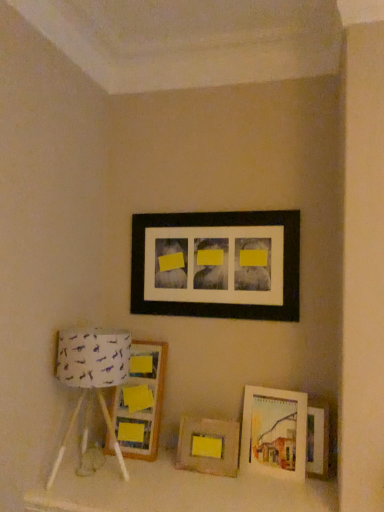
What do you see at coordinates (274, 432) in the screenshot?
I see `matte wooden picture frame at lower right, acting as the third picture frame starting from the bottom` at bounding box center [274, 432].

What are the coordinates of `black matte picture frame at upper center, the first picture frame in the top-to-bottom sequence` in the screenshot? It's located at (217, 265).

The image size is (384, 512). What do you see at coordinates (143, 409) in the screenshot?
I see `wooden picture frame at left, which appears as the 4th picture frame when ordered from the bottom` at bounding box center [143, 409].

Measure the distance between wooden picture frame at left, which appears as the 4th picture frame when ordered from the bottom, and camera.

The depth of wooden picture frame at left, which appears as the 4th picture frame when ordered from the bottom, is 6.29 feet.

Looking at this image, measure the distance between point (x=314, y=461) and camera.

The depth of point (x=314, y=461) is 1.80 meters.

What is the approximate width of wooden picture frame at lower right, the second picture frame positioned from the bottom?

wooden picture frame at lower right, the second picture frame positioned from the bottom, is 4.06 centimeters wide.

Measure the distance between white fabric lampshade at left and camera.

The distance of white fabric lampshade at left from camera is 5.54 feet.

Describe the element at coordinates (91, 378) in the screenshot. Image resolution: width=384 pixels, height=512 pixels. I see `white fabric lampshade at left` at that location.

The width and height of the screenshot is (384, 512). I want to click on matte wooden picture frame at lower right, acting as the third picture frame starting from the bottom, so click(274, 432).

Is wooden picture frame at left, which is the second picture frame in top-to-bottom order, taller or shorter than matte wooden picture frame at lower right, which appears as the 3th picture frame when viewed from the top?

Answer: Clearly, wooden picture frame at left, which is the second picture frame in top-to-bottom order, is taller compared to matte wooden picture frame at lower right, which appears as the 3th picture frame when viewed from the top.

Is wooden picture frame at left, which is the second picture frame in top-to-bottom order, bigger than matte wooden picture frame at lower right, which appears as the 3th picture frame when viewed from the top?

Correct, wooden picture frame at left, which is the second picture frame in top-to-bottom order, is larger in size than matte wooden picture frame at lower right, which appears as the 3th picture frame when viewed from the top.

Can matte wooden picture frame at lower right, which appears as the 3th picture frame when viewed from the top, be found inside wooden picture frame at left, which appears as the 4th picture frame when ordered from the bottom?

No, matte wooden picture frame at lower right, which appears as the 3th picture frame when viewed from the top, is not inside wooden picture frame at left, which appears as the 4th picture frame when ordered from the bottom.

Does point (142, 380) lie in front of point (272, 438)?

No, it is behind (272, 438).

Between wooden frame at center, which appears as the 1th picture frame when ordered from the bottom, and matte wooden picture frame at lower right, which appears as the 3th picture frame when viewed from the top, which one appears on the left side from the viewer's perspective?

Positioned to the left is wooden frame at center, which appears as the 1th picture frame when ordered from the bottom.

Between wooden frame at center, which appears as the 1th picture frame when ordered from the bottom, and matte wooden picture frame at lower right, acting as the third picture frame starting from the bottom, which one has more height?

With more height is matte wooden picture frame at lower right, acting as the third picture frame starting from the bottom.

Does wooden frame at center, which appears as the 1th picture frame when ordered from the bottom, turn towards matte wooden picture frame at lower right, which appears as the 3th picture frame when viewed from the top?

No, wooden frame at center, which appears as the 1th picture frame when ordered from the bottom, is not aimed at matte wooden picture frame at lower right, which appears as the 3th picture frame when viewed from the top.

How far apart are black matte picture frame at upper center, the first picture frame in the top-to-bottom sequence, and wooden picture frame at left, which appears as the 4th picture frame when ordered from the bottom?

black matte picture frame at upper center, the first picture frame in the top-to-bottom sequence, is 18.70 inches away from wooden picture frame at left, which appears as the 4th picture frame when ordered from the bottom.

Is black matte picture frame at upper center, arranged as the fifth picture frame when ordered from the bottom, turned away from wooden picture frame at left, which is the second picture frame in top-to-bottom order?

black matte picture frame at upper center, arranged as the fifth picture frame when ordered from the bottom, is not turned away from wooden picture frame at left, which is the second picture frame in top-to-bottom order.

Considering the relative sizes of black matte picture frame at upper center, arranged as the fifth picture frame when ordered from the bottom, and wooden picture frame at left, which appears as the 4th picture frame when ordered from the bottom, in the image provided, is black matte picture frame at upper center, arranged as the fifth picture frame when ordered from the bottom, thinner than wooden picture frame at left, which appears as the 4th picture frame when ordered from the bottom,?

Correct, the width of black matte picture frame at upper center, arranged as the fifth picture frame when ordered from the bottom, is less than that of wooden picture frame at left, which appears as the 4th picture frame when ordered from the bottom.

Is point (289, 289) less distant than point (156, 442)?

Yes, point (289, 289) is in front of point (156, 442).

Considering the sizes of wooden frame at center, arranged as the 5th picture frame when viewed from the top, and black matte picture frame at upper center, the first picture frame in the top-to-bottom sequence, in the image, is wooden frame at center, arranged as the 5th picture frame when viewed from the top, wider or thinner than black matte picture frame at upper center, the first picture frame in the top-to-bottom sequence,?

Clearly, wooden frame at center, arranged as the 5th picture frame when viewed from the top, has more width compared to black matte picture frame at upper center, the first picture frame in the top-to-bottom sequence.

You are a GUI agent. You are given a task and a screenshot of the screen. Output one action in this format:
    pyautogui.click(x=<x>, y=<y>)
    Task: Click on the picture frame that is the 4th one when counting downward from the black matte picture frame at upper center, the first picture frame in the top-to-bottom sequence (from the image's perspective)
    
    Given the screenshot: What is the action you would take?
    pyautogui.click(x=208, y=446)

Is wooden frame at center, which appears as the 1th picture frame when ordered from the bottom, facing away from black matte picture frame at upper center, arranged as the fifth picture frame when ordered from the bottom?

wooden frame at center, which appears as the 1th picture frame when ordered from the bottom, does not have its back to black matte picture frame at upper center, arranged as the fifth picture frame when ordered from the bottom.

Is wooden frame at center, arranged as the 5th picture frame when viewed from the top, at the left side of black matte picture frame at upper center, arranged as the fifth picture frame when ordered from the bottom?

Indeed, wooden frame at center, arranged as the 5th picture frame when viewed from the top, is positioned on the left side of black matte picture frame at upper center, arranged as the fifth picture frame when ordered from the bottom.

Considering the sizes of objects wooden picture frame at lower right, the second picture frame positioned from the bottom, and matte wooden picture frame at lower right, which appears as the 3th picture frame when viewed from the top, in the image provided, who is smaller, wooden picture frame at lower right, the second picture frame positioned from the bottom, or matte wooden picture frame at lower right, which appears as the 3th picture frame when viewed from the top,?

Smaller between the two is wooden picture frame at lower right, the second picture frame positioned from the bottom.

Can you tell me how much wooden picture frame at lower right, the second picture frame positioned from the bottom, and matte wooden picture frame at lower right, acting as the third picture frame starting from the bottom, differ in facing direction?

5.93 degrees separate the facing orientations of wooden picture frame at lower right, the second picture frame positioned from the bottom, and matte wooden picture frame at lower right, acting as the third picture frame starting from the bottom.

Is wooden picture frame at lower right, the second picture frame positioned from the bottom, touching matte wooden picture frame at lower right, which appears as the 3th picture frame when viewed from the top?

There is a gap between wooden picture frame at lower right, the second picture frame positioned from the bottom, and matte wooden picture frame at lower right, which appears as the 3th picture frame when viewed from the top.

Could you tell me if black matte picture frame at upper center, the first picture frame in the top-to-bottom sequence, is turned towards wooden frame at center, arranged as the 5th picture frame when viewed from the top?

No, black matte picture frame at upper center, the first picture frame in the top-to-bottom sequence, is not turned towards wooden frame at center, arranged as the 5th picture frame when viewed from the top.

Is black matte picture frame at upper center, arranged as the fifth picture frame when ordered from the bottom, taller or shorter than wooden frame at center, arranged as the 5th picture frame when viewed from the top?

Clearly, black matte picture frame at upper center, arranged as the fifth picture frame when ordered from the bottom, is taller compared to wooden frame at center, arranged as the 5th picture frame when viewed from the top.

From the image's perspective, is black matte picture frame at upper center, the first picture frame in the top-to-bottom sequence, above or below wooden frame at center, which appears as the 1th picture frame when ordered from the bottom?

Based on their image positions, black matte picture frame at upper center, the first picture frame in the top-to-bottom sequence, is located above wooden frame at center, which appears as the 1th picture frame when ordered from the bottom.

Which object is wider, wooden picture frame at left, which appears as the 4th picture frame when ordered from the bottom, or white fabric lampshade at left?

With larger width is white fabric lampshade at left.

Is wooden picture frame at left, which is the second picture frame in top-to-bottom order, not near white fabric lampshade at left?

wooden picture frame at left, which is the second picture frame in top-to-bottom order, is actually quite close to white fabric lampshade at left.

How many degrees apart are the facing directions of wooden picture frame at left, which is the second picture frame in top-to-bottom order, and white fabric lampshade at left?

There is a 3.87-degree angle between the facing directions of wooden picture frame at left, which is the second picture frame in top-to-bottom order, and white fabric lampshade at left.

At what (x,y) coordinates should I click in order to perform the action: click on picture frame that is the 1st one above the matte wooden picture frame at lower right, which appears as the 3th picture frame when viewed from the top (from a real-world perspective). Please return your answer as a coordinate pair (x, y). This screenshot has width=384, height=512. Looking at the image, I should click on (143, 409).

This screenshot has height=512, width=384. Find the location of `the 2nd picture frame in front of the wooden frame at center, arranged as the 5th picture frame when viewed from the top`. the 2nd picture frame in front of the wooden frame at center, arranged as the 5th picture frame when viewed from the top is located at coordinates (274, 432).

Considering their positions, is matte wooden picture frame at lower right, which appears as the 3th picture frame when viewed from the top, positioned closer to black matte picture frame at upper center, arranged as the fifth picture frame when ordered from the bottom, than wooden picture frame at left, which is the second picture frame in top-to-bottom order?

wooden picture frame at left, which is the second picture frame in top-to-bottom order.

When comparing their distances from black matte picture frame at upper center, the first picture frame in the top-to-bottom sequence, does matte wooden picture frame at lower right, which appears as the 3th picture frame when viewed from the top, or wooden picture frame at lower right, which ranks as the fourth picture frame in top-to-bottom order, seem closer?

Among the two, matte wooden picture frame at lower right, which appears as the 3th picture frame when viewed from the top, is located nearer to black matte picture frame at upper center, the first picture frame in the top-to-bottom sequence.

From the image, which object appears to be nearer to black matte picture frame at upper center, arranged as the fifth picture frame when ordered from the bottom, wooden picture frame at left, which is the second picture frame in top-to-bottom order, or matte wooden picture frame at lower right, which appears as the 3th picture frame when viewed from the top?

Among the two, wooden picture frame at left, which is the second picture frame in top-to-bottom order, is located nearer to black matte picture frame at upper center, arranged as the fifth picture frame when ordered from the bottom.

From the image, which object appears to be farther from matte wooden picture frame at lower right, acting as the third picture frame starting from the bottom, white fabric lampshade at left or wooden frame at center, arranged as the 5th picture frame when viewed from the top?

white fabric lampshade at left is further to matte wooden picture frame at lower right, acting as the third picture frame starting from the bottom.

From the image, which object appears to be farther from white fabric lampshade at left, wooden picture frame at left, which is the second picture frame in top-to-bottom order, or matte wooden picture frame at lower right, acting as the third picture frame starting from the bottom?

Based on the image, matte wooden picture frame at lower right, acting as the third picture frame starting from the bottom, appears to be further to white fabric lampshade at left.

Looking at the image, which one is located closer to black matte picture frame at upper center, arranged as the fifth picture frame when ordered from the bottom, white fabric lampshade at left or wooden frame at center, which appears as the 1th picture frame when ordered from the bottom?

Based on the image, white fabric lampshade at left appears to be nearer to black matte picture frame at upper center, arranged as the fifth picture frame when ordered from the bottom.

Which object lies nearer to the anchor point black matte picture frame at upper center, arranged as the fifth picture frame when ordered from the bottom, wooden picture frame at lower right, which ranks as the fourth picture frame in top-to-bottom order, or white fabric lampshade at left?

white fabric lampshade at left is closer to black matte picture frame at upper center, arranged as the fifth picture frame when ordered from the bottom.

Looking at the image, which one is located closer to wooden picture frame at lower right, which ranks as the fourth picture frame in top-to-bottom order, white fabric lampshade at left or wooden picture frame at left, which appears as the 4th picture frame when ordered from the bottom?

wooden picture frame at left, which appears as the 4th picture frame when ordered from the bottom, is positioned closer to the anchor wooden picture frame at lower right, which ranks as the fourth picture frame in top-to-bottom order.

I want to click on table lamp that lies between black matte picture frame at upper center, the first picture frame in the top-to-bottom sequence, and wooden picture frame at left, which is the second picture frame in top-to-bottom order, from top to bottom, so click(91, 378).

Where is `picture frame between white fabric lampshade at left and wooden frame at center, arranged as the 5th picture frame when viewed from the top`? picture frame between white fabric lampshade at left and wooden frame at center, arranged as the 5th picture frame when viewed from the top is located at coordinates (143, 409).

At what (x,y) coordinates should I click in order to perform the action: click on table lamp between black matte picture frame at upper center, arranged as the fifth picture frame when ordered from the bottom, and wooden frame at center, arranged as the 5th picture frame when viewed from the top, in the vertical direction. Please return your answer as a coordinate pair (x, y). Image resolution: width=384 pixels, height=512 pixels. Looking at the image, I should click on (91, 378).

This screenshot has height=512, width=384. What are the coordinates of `picture frame between black matte picture frame at upper center, arranged as the fifth picture frame when ordered from the bottom, and matte wooden picture frame at lower right, which appears as the 3th picture frame when viewed from the top, vertically` in the screenshot? It's located at (143, 409).